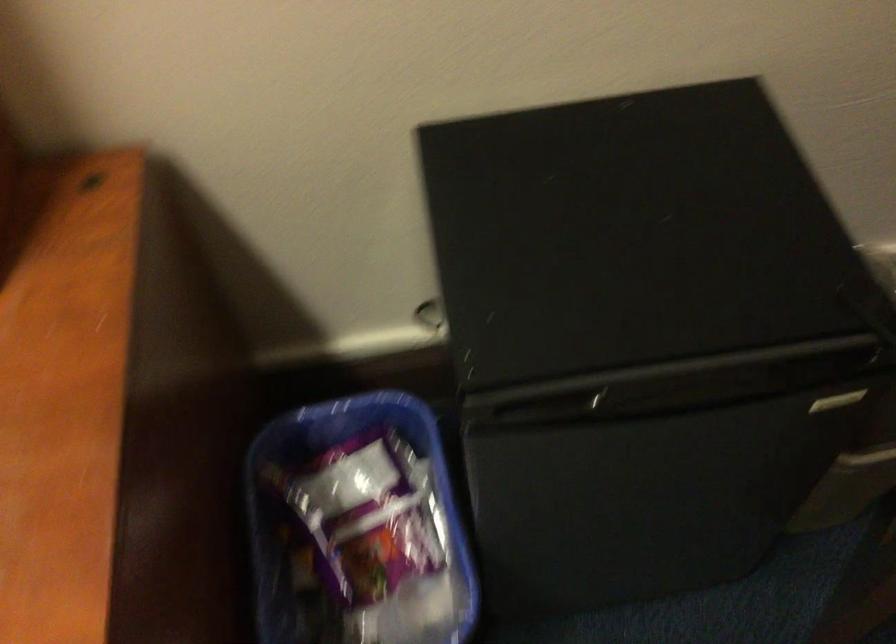
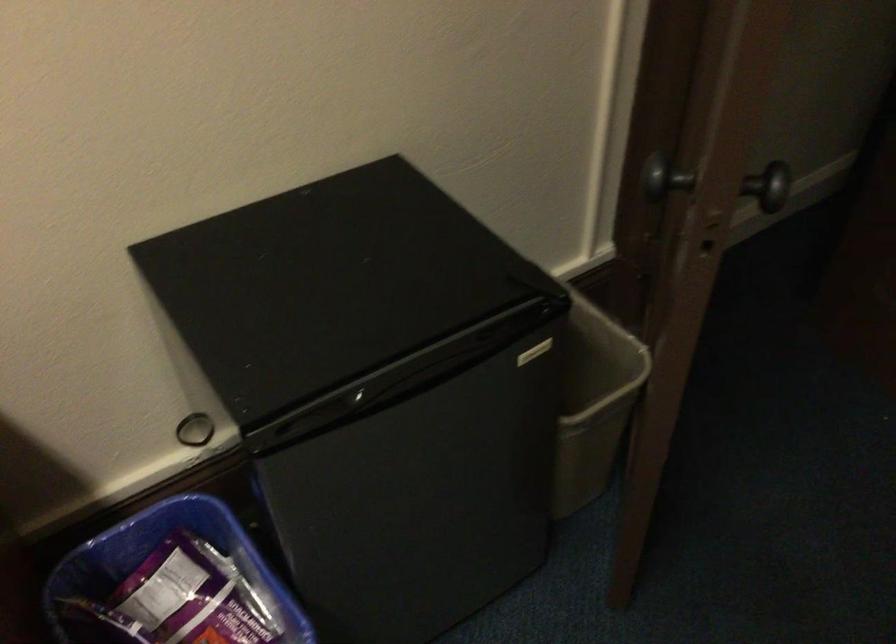
Find the pixel in the second image that matches (x=605, y=389) in the first image.

(365, 399)